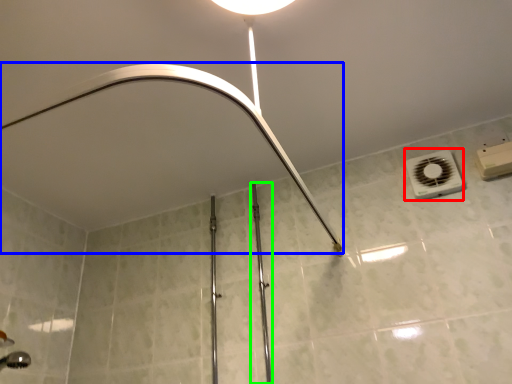
Question: Which object is the closest to the air conditioning (highlighted by a red box)? Choose among these: shower (highlighted by a blue box) or rail (highlighted by a green box).

Choices:
 (A) shower
 (B) rail

Answer: (A)